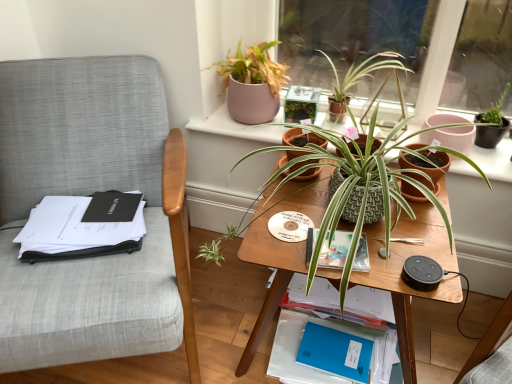
Question: Is terracotta clay pot at center-right, which is counted as the second flowerpot, starting from the left, taller or shorter than blue matte notebook at lower center?

Choices:
 (A) short
 (B) tall

Answer: (B)

Question: From the image's perspective, is terracotta clay pot at center-right, which is counted as the second flowerpot, starting from the left, positioned above or below blue matte notebook at lower center?

Choices:
 (A) below
 (B) above

Answer: (B)

Question: Based on their relative distances, which object is nearer to the terracotta pots at upper center?

Choices:
 (A) green textured pot at center, placed as the 2th flowerpot when sorted from right to left
 (B) blue matte notebook at lower center
 (C) hardcover book at center, arranged as the 2th paperback book when ordered from the bottom
 (D) matte pink pot at upper center, which ranks as the third houseplant in bottom-to-top order
 (E) green leafy plant at center, the second houseplant when ordered from top to bottom

Answer: (C)

Question: Which is farther from the wooden table at center?

Choices:
 (A) textured gray fabric chair at left
 (B) matte pink pot at upper center, the 1th houseplant viewed from the top
 (C) blue matte notebook at lower center
 (D) textured terracotta pot at center, positioned as the third houseplant in top-to-bottom order
 (E) green leafy plant at center, the second houseplant when ordered from top to bottom

Answer: (B)